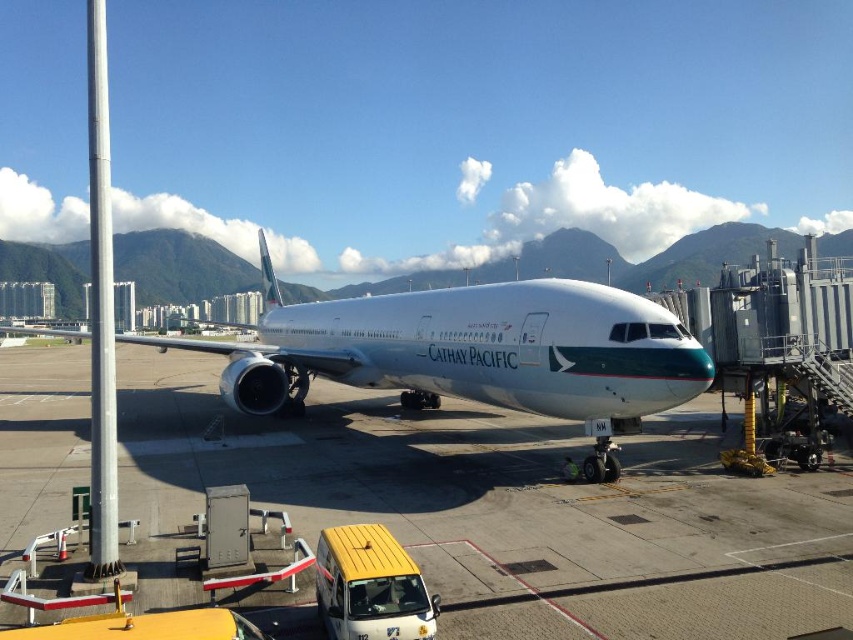
Is point (646, 636) behind point (294, 310)?

No.

Does white glossy tarmac at center appear under white glossy airplane at center?

Indeed, white glossy tarmac at center is positioned under white glossy airplane at center.

Which is behind, point (186, 500) or point (352, 374)?

Positioned behind is point (352, 374).

I want to click on white glossy tarmac at center, so click(509, 508).